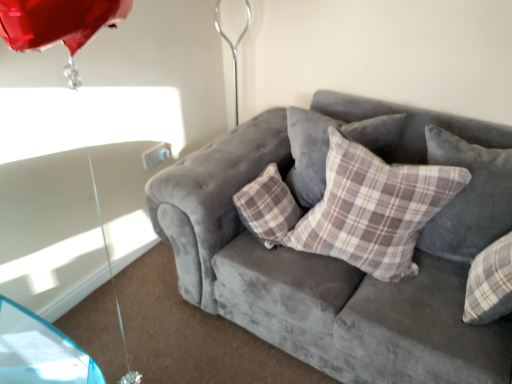
I want to click on velvet gray couch at center, so click(315, 279).

In order to face velvet gray couch at center, should I rotate leftwards or rightwards?

To face it directly, rotate right by 12.806 degrees.

At what (x,y) coordinates should I click in order to perform the action: click on plaid fabric pillow at center, which is the 3th pillow in left-to-right order. Please return your answer as a coordinate pair (x, y). Looking at the image, I should click on (468, 198).

This screenshot has width=512, height=384. I want to click on plaid fabric pillow at center, acting as the 1th pillow starting from the left, so click(x=328, y=147).

Looking at this image, considering the sizes of objects velvet gray couch at center and plaid fabric pillow at center, which is the 3th pillow in left-to-right order, in the image provided, who is wider, velvet gray couch at center or plaid fabric pillow at center, which is the 3th pillow in left-to-right order,?

velvet gray couch at center is wider.

Considering the relative positions of velvet gray couch at center and plaid fabric pillow at center, the first pillow from the right, in the image provided, is velvet gray couch at center to the left of plaid fabric pillow at center, the first pillow from the right, from the viewer's perspective?

Correct, you'll find velvet gray couch at center to the left of plaid fabric pillow at center, the first pillow from the right.

Would you say velvet gray couch at center is a long distance from plaid fabric pillow at center, which is the 3th pillow in left-to-right order?

No, there isn't a large distance between velvet gray couch at center and plaid fabric pillow at center, which is the 3th pillow in left-to-right order.

Does velvet gray couch at center have a greater height compared to plaid fabric pillow at center, which is the 3th pillow in left-to-right order?

Indeed, velvet gray couch at center has a greater height compared to plaid fabric pillow at center, which is the 3th pillow in left-to-right order.

Choose the correct answer: Is plaid fabric pillow at center, the first pillow from the right, inside velvet gray couch at center or outside it?

plaid fabric pillow at center, the first pillow from the right, is enclosed within velvet gray couch at center.

Considering the sizes of objects plaid fabric pillow at center, the first pillow from the right, and velvet gray couch at center in the image provided, who is taller, plaid fabric pillow at center, the first pillow from the right, or velvet gray couch at center?

velvet gray couch at center is taller.

Is plaid fabric pillow at center, the first pillow from the right, oriented towards velvet gray couch at center?

Yes, plaid fabric pillow at center, the first pillow from the right, is oriented towards velvet gray couch at center.

Between plaid fabric pillow at center, which is the 3th pillow in left-to-right order, and velvet gray couch at center, which one has smaller size?

plaid fabric pillow at center, which is the 3th pillow in left-to-right order, is smaller.

Considering the positions of objects plaid fabric pillow at center, arranged as the second pillow when viewed from the left, and velvet gray couch at center in the image provided, who is behind, plaid fabric pillow at center, arranged as the second pillow when viewed from the left, or velvet gray couch at center?

plaid fabric pillow at center, arranged as the second pillow when viewed from the left.

Is plaid fabric pillow at center, which appears as the second pillow when viewed from the right, facing towards velvet gray couch at center?

Yes.

Can we say plaid fabric pillow at center, arranged as the second pillow when viewed from the left, lies outside velvet gray couch at center?

No, plaid fabric pillow at center, arranged as the second pillow when viewed from the left, is not entirely external to velvet gray couch at center.

Is point (449, 144) in front of point (305, 168)?

Yes.

Is plaid fabric pillow at center, the first pillow from the right, taller than plaid fabric pillow at center, acting as the 1th pillow starting from the left?

Yes, plaid fabric pillow at center, the first pillow from the right, is taller than plaid fabric pillow at center, acting as the 1th pillow starting from the left.

Does plaid fabric pillow at center, the first pillow from the right, contain plaid fabric pillow at center, acting as the 1th pillow starting from the left?

No, plaid fabric pillow at center, acting as the 1th pillow starting from the left, is not inside plaid fabric pillow at center, the first pillow from the right.

How distant is plaid fabric pillow at center, which is the 3th pillow in left-to-right order, from plaid fabric pillow at center, acting as the 1th pillow starting from the left?

They are 14.93 inches apart.

Is plaid fabric pillow at center, acting as the third pillow starting from the right, at the right side of plaid fabric pillow at center, the first pillow from the right?

No, plaid fabric pillow at center, acting as the third pillow starting from the right, is not to the right of plaid fabric pillow at center, the first pillow from the right.

Consider the image. Is plaid fabric pillow at center, acting as the third pillow starting from the right, touching plaid fabric pillow at center, which is the 3th pillow in left-to-right order?

There is a gap between plaid fabric pillow at center, acting as the third pillow starting from the right, and plaid fabric pillow at center, which is the 3th pillow in left-to-right order.

Is plaid fabric pillow at center, acting as the third pillow starting from the right, facing away from plaid fabric pillow at center, the first pillow from the right?

plaid fabric pillow at center, acting as the third pillow starting from the right, is not turned away from plaid fabric pillow at center, the first pillow from the right.

Locate an element on the screen. This screenshot has width=512, height=384. the 1st pillow above the plaid fabric pillow at center, which appears as the second pillow when viewed from the right (from the image's perspective) is located at coordinates (468, 198).

Looking at the image, does plaid fabric pillow at center, which is the 3th pillow in left-to-right order, seem bigger or smaller compared to plaid fabric pillow at center, which appears as the second pillow when viewed from the right?

Considering their sizes, plaid fabric pillow at center, which is the 3th pillow in left-to-right order, takes up less space than plaid fabric pillow at center, which appears as the second pillow when viewed from the right.

Can you confirm if plaid fabric pillow at center, acting as the 1th pillow starting from the left, is thinner than velvet gray couch at center?

Indeed, plaid fabric pillow at center, acting as the 1th pillow starting from the left, has a lesser width compared to velvet gray couch at center.

Does plaid fabric pillow at center, acting as the third pillow starting from the right, come in front of velvet gray couch at center?

No.

From a real-world perspective, does plaid fabric pillow at center, acting as the 1th pillow starting from the left, sit lower than velvet gray couch at center?

Incorrect, from a real-world perspective, plaid fabric pillow at center, acting as the 1th pillow starting from the left, is higher than velvet gray couch at center.

At what (x,y) coordinates should I click in order to perform the action: click on studio couch on the left of the plaid fabric pillow at center, which is the 3th pillow in left-to-right order. Please return your answer as a coordinate pair (x, y). This screenshot has height=384, width=512. Looking at the image, I should click on (315, 279).

In order to click on pillow that is the 2nd object located behind the velvet gray couch at center in this screenshot , I will do `click(468, 198)`.

Estimate the real-world distances between objects in this image. Which object is closer to plaid fabric pillow at center, acting as the 1th pillow starting from the left, plaid fabric pillow at center, the first pillow from the right, or velvet gray couch at center?

velvet gray couch at center is positioned closer to the anchor plaid fabric pillow at center, acting as the 1th pillow starting from the left.

Which object lies nearer to the anchor point velvet gray couch at center, plaid fabric pillow at center, acting as the 1th pillow starting from the left, or plaid fabric pillow at center, arranged as the second pillow when viewed from the left?

plaid fabric pillow at center, arranged as the second pillow when viewed from the left, is positioned closer to the anchor velvet gray couch at center.

Estimate the real-world distances between objects in this image. Which object is closer to plaid fabric pillow at center, arranged as the second pillow when viewed from the left, plaid fabric pillow at center, acting as the third pillow starting from the right, or velvet gray couch at center?

velvet gray couch at center is closer to plaid fabric pillow at center, arranged as the second pillow when viewed from the left.

Looking at the image, which one is located closer to plaid fabric pillow at center, arranged as the second pillow when viewed from the left, velvet gray couch at center or plaid fabric pillow at center, which is the 3th pillow in left-to-right order?

plaid fabric pillow at center, which is the 3th pillow in left-to-right order.

Consider the image. Considering their positions, is velvet gray couch at center positioned further to plaid fabric pillow at center, which appears as the second pillow when viewed from the right, than plaid fabric pillow at center, acting as the third pillow starting from the right?

The object further to plaid fabric pillow at center, which appears as the second pillow when viewed from the right, is plaid fabric pillow at center, acting as the third pillow starting from the right.

Considering their positions, is plaid fabric pillow at center, the first pillow from the right, positioned closer to plaid fabric pillow at center, acting as the 1th pillow starting from the left, than plaid fabric pillow at center, arranged as the second pillow when viewed from the left?

Among the two, plaid fabric pillow at center, arranged as the second pillow when viewed from the left, is located nearer to plaid fabric pillow at center, acting as the 1th pillow starting from the left.

From the image, which object appears to be nearer to plaid fabric pillow at center, acting as the 1th pillow starting from the left, velvet gray couch at center or plaid fabric pillow at center, arranged as the second pillow when viewed from the left?

The object closer to plaid fabric pillow at center, acting as the 1th pillow starting from the left, is plaid fabric pillow at center, arranged as the second pillow when viewed from the left.

Which object lies further to the anchor point velvet gray couch at center, plaid fabric pillow at center, which is the 3th pillow in left-to-right order, or plaid fabric pillow at center, acting as the 1th pillow starting from the left?

Based on the image, plaid fabric pillow at center, which is the 3th pillow in left-to-right order, appears to be further to velvet gray couch at center.

Where is `pillow situated between velvet gray couch at center and plaid fabric pillow at center, which is the 3th pillow in left-to-right order, from left to right`? pillow situated between velvet gray couch at center and plaid fabric pillow at center, which is the 3th pillow in left-to-right order, from left to right is located at coordinates (373, 209).

At what (x,y) coordinates should I click in order to perform the action: click on pillow between plaid fabric pillow at center, acting as the third pillow starting from the right, and plaid fabric pillow at center, which is the 3th pillow in left-to-right order, from left to right. Please return your answer as a coordinate pair (x, y). Looking at the image, I should click on (373, 209).